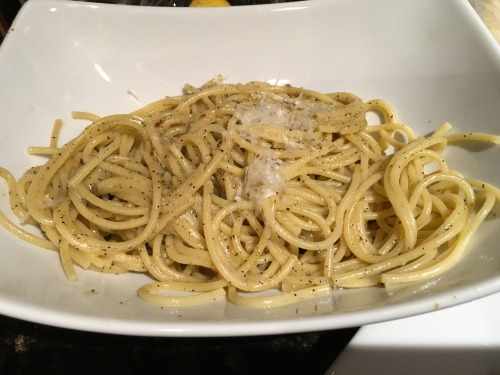
The width and height of the screenshot is (500, 375). In order to click on table/surface in this screenshot , I will do `click(250, 349)`.